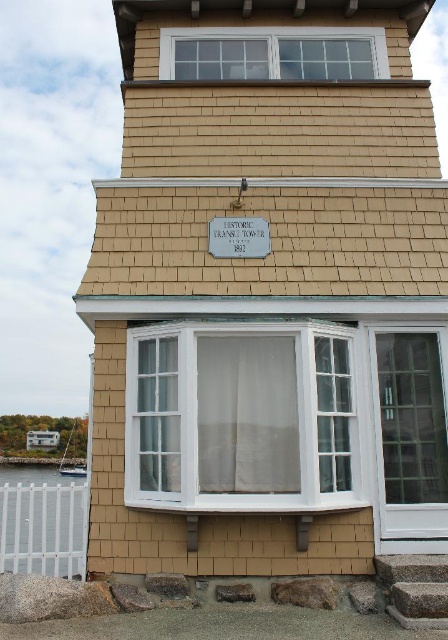
From the picture: Does white glass window at upper center have a greater height compared to white plastic fence at lower left?

In fact, white glass window at upper center may be shorter than white plastic fence at lower left.

Between white glass window at upper center and white plastic fence at lower left, which one has less height?

white glass window at upper center

This screenshot has width=448, height=640. Describe the element at coordinates (272, 54) in the screenshot. I see `white glass window at upper center` at that location.

The height and width of the screenshot is (640, 448). I want to click on white glass window at upper center, so (x=272, y=54).

Can you confirm if white glass window at center is wider than white glass window at upper center?

In fact, white glass window at center might be narrower than white glass window at upper center.

Who is more forward, (327,388) or (300,38)?

Positioned in front is point (327,388).

The width and height of the screenshot is (448, 640). What are the coordinates of `white glass window at center` in the screenshot? It's located at pyautogui.click(x=241, y=417).

Does white glass window at center have a smaller size compared to white plastic fence at lower left?

Indeed, white glass window at center has a smaller size compared to white plastic fence at lower left.

Between white glass window at center and white plastic fence at lower left, which one is positioned lower?

white plastic fence at lower left

The image size is (448, 640). Identify the location of white glass window at center. (241, 417).